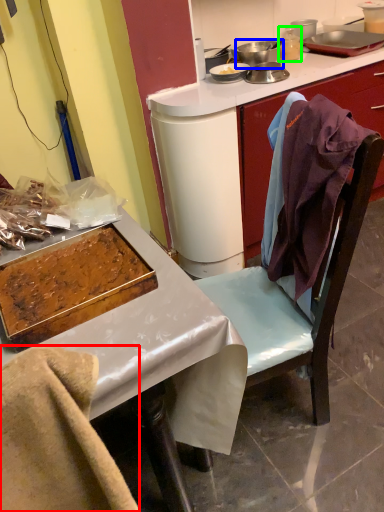
Question: Which is farther away from leftover (highlighted by a red box)? appliance (highlighted by a blue box) or appliance (highlighted by a green box)?

Choices:
 (A) appliance
 (B) appliance

Answer: (B)